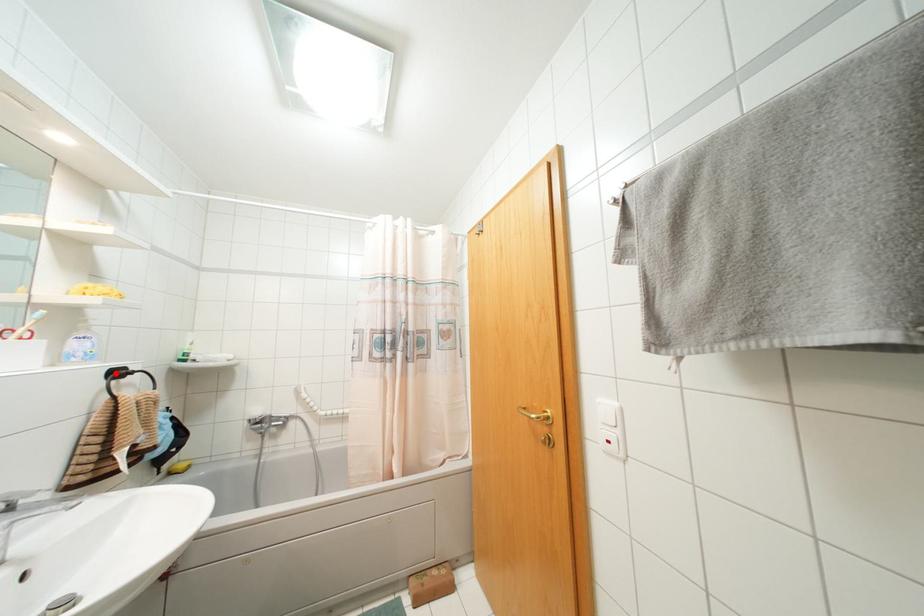
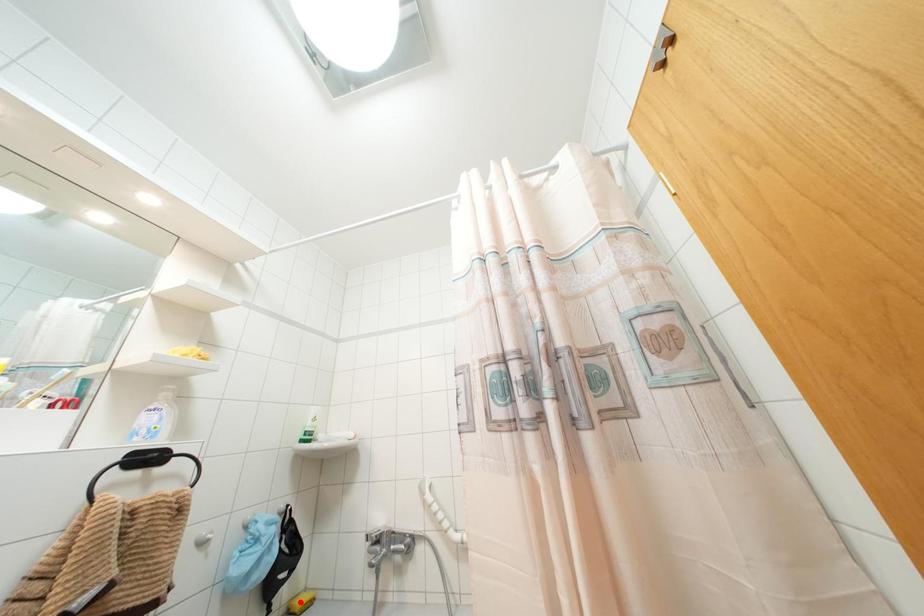
I am providing you with two images of the same scene from different viewpoints. A red point is marked on the first image and another point is marked on the second image. Do the highlighted points in image1 and image2 indicate the same real-world spot?

No